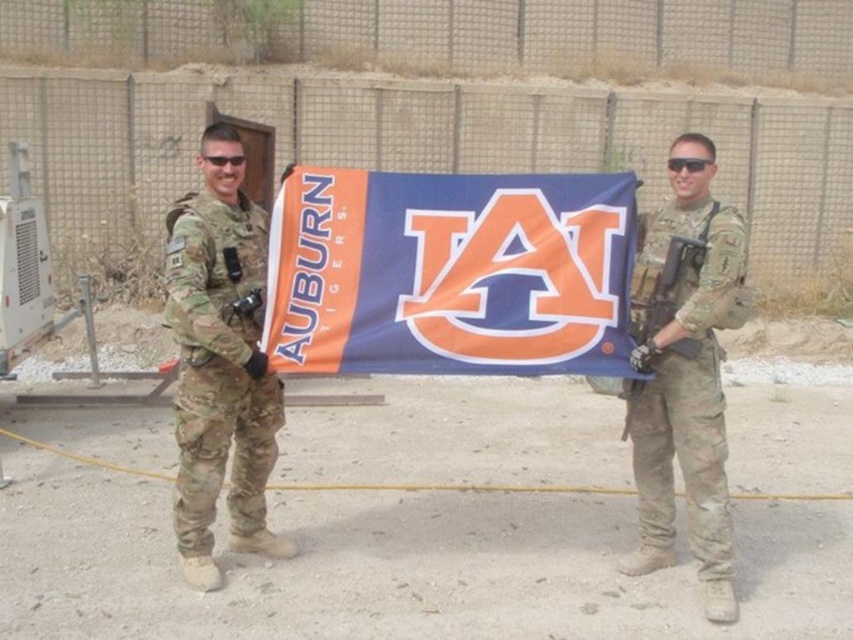
Question: Does blue fabric flag at center appear under camouflage fabric uniform at right?

Choices:
 (A) no
 (B) yes

Answer: (A)

Question: Which of these objects is positioned closest to the camouflage fabric uniform at right?

Choices:
 (A) camouflage fabric uniform at left
 (B) matte black rifle at right
 (C) blue fabric flag at center

Answer: (B)

Question: Is the position of blue fabric flag at center less distant than that of matte black rifle at right?

Choices:
 (A) yes
 (B) no

Answer: (A)

Question: Which of the following is the closest to the observer?

Choices:
 (A) camouflage fabric uniform at right
 (B) blue fabric flag at center

Answer: (B)

Question: Among these objects, which one is nearest to the camera?

Choices:
 (A) camouflage fabric uniform at right
 (B) blue fabric flag at center

Answer: (B)

Question: Does camouflage fabric uniform at left have a larger size compared to camouflage fabric uniform at right?

Choices:
 (A) yes
 (B) no

Answer: (B)